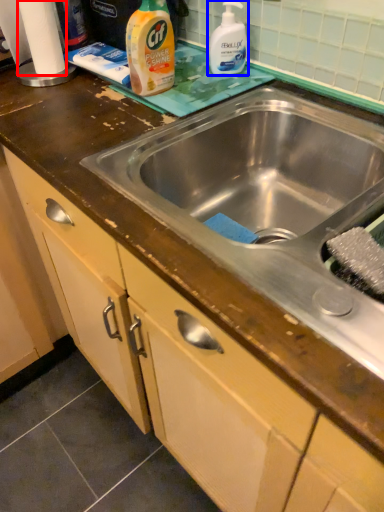
Question: Which object is further to the camera taking this photo, toilet paper (highlighted by a red box) or cleaning product (highlighted by a blue box)?

Choices:
 (A) toilet paper
 (B) cleaning product

Answer: (A)